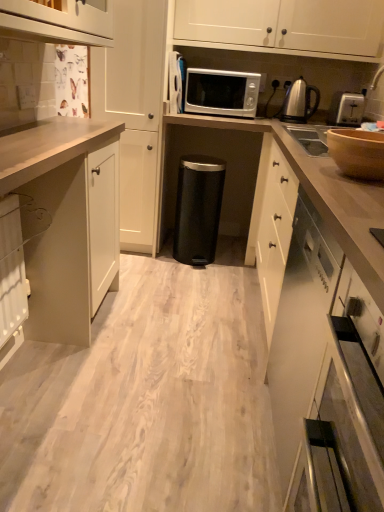
Question: Would you say black matte trash can at center is inside or outside wooden bowl at upper right?

Choices:
 (A) outside
 (B) inside

Answer: (A)

Question: Considering the positions of black matte trash can at center and wooden bowl at upper right in the image, is black matte trash can at center wider or thinner than wooden bowl at upper right?

Choices:
 (A) thin
 (B) wide

Answer: (B)

Question: Which of these objects is positioned farthest from the black matte trash can at center?

Choices:
 (A) wooden bowl at upper right
 (B) matte white cabinet at left, which is the second cabinetry in front-to-back order
 (C) silver metallic microwave at center
 (D) white matte cabinet at upper center, acting as the 1th cabinetry starting from the back
 (E) white matte cabinet at lower right, which appears as the first cabinetry when viewed from the front

Answer: (D)

Question: Which object is the farthest from the wooden bowl at upper right?

Choices:
 (A) black matte trash can at center
 (B) silver metallic microwave at center
 (C) white matte cabinet at upper center, which is the 4th cabinetry from front to back
 (D) wooden bowl at upper right
 (E) white matte cabinet at center, arranged as the 2th cabinetry when viewed from the back

Answer: (E)